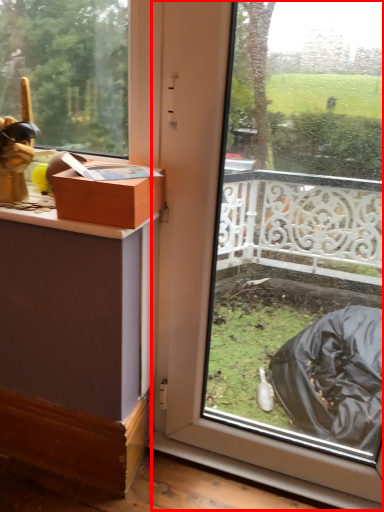
Question: From the image's perspective, where is glass door (annotated by the red box) located relative to box?

Choices:
 (A) above
 (B) below

Answer: (B)